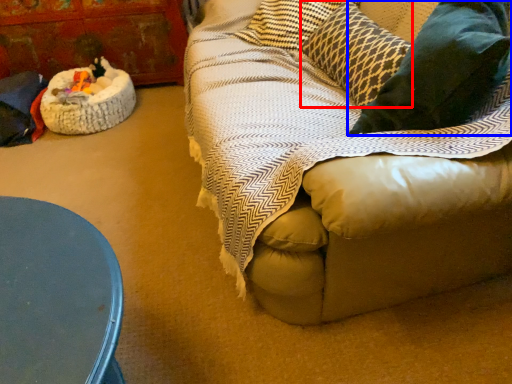
Question: Among these objects, which one is farthest to the camera, pillow (highlighted by a red box) or throw pillow (highlighted by a blue box)?

Choices:
 (A) pillow
 (B) throw pillow

Answer: (A)